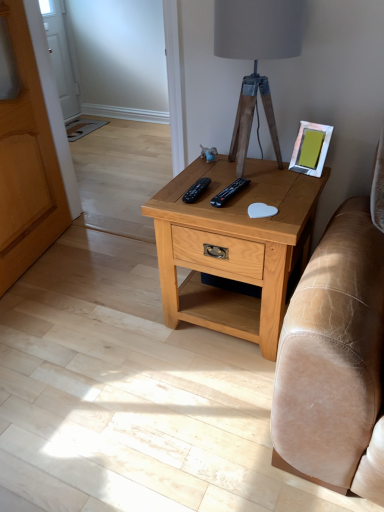
Question: Is wooden armoire at left in front of or behind metallic silver picture frame at upper right in the image?

Choices:
 (A) front
 (B) behind

Answer: (A)

Question: Is wooden armoire at left inside the boundaries of metallic silver picture frame at upper right, or outside?

Choices:
 (A) outside
 (B) inside

Answer: (A)

Question: Estimate the real-world distances between objects in this image. Which object is farther from the wooden armoire at left?

Choices:
 (A) black plastic remote at center, placed as the first remote when sorted from left to right
 (B) metallic silver picture frame at upper right
 (C) light brown wood nightstand at center
 (D) black plastic remote at center, which is the 1th remote in right-to-left order
 (E) wooden tripod lamp at center

Answer: (B)

Question: Which object is positioned farthest from the wooden armoire at left?

Choices:
 (A) black plastic remote at center, placed as the first remote when sorted from left to right
 (B) metallic silver picture frame at upper right
 (C) light brown wood nightstand at center
 (D) wooden tripod lamp at center
 (E) black plastic remote at center, which is the second remote in left-to-right order

Answer: (B)